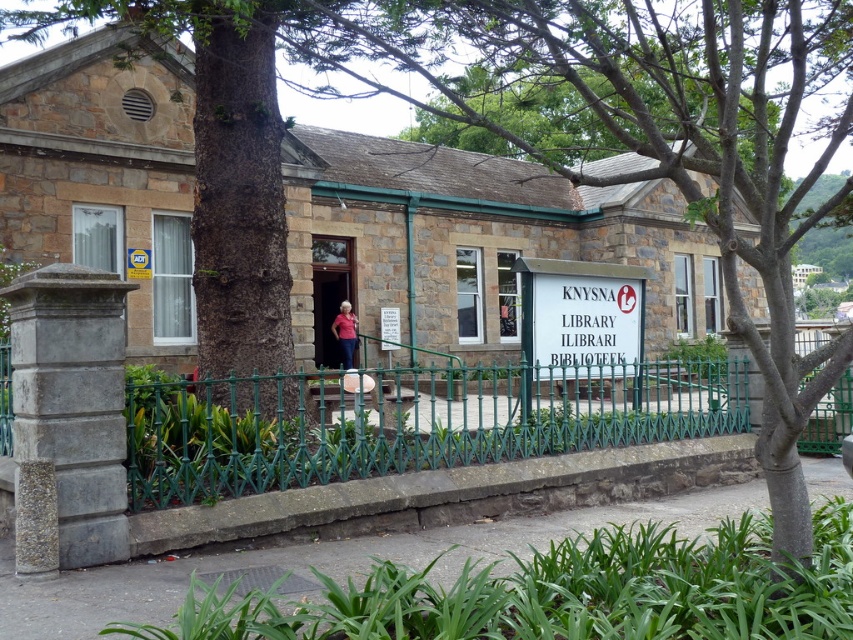
Can you confirm if green leafy tree at center is smaller than white plastic sign at center?

No, green leafy tree at center is not smaller than white plastic sign at center.

Is green leafy tree at center above white plastic sign at center?

Yes, green leafy tree at center is above white plastic sign at center.

Identify the location of green leafy tree at center. This screenshot has height=640, width=853. (669, 144).

Can you confirm if green leafy tree at center is bigger than green wrought iron fence at center?

Indeed, green leafy tree at center has a larger size compared to green wrought iron fence at center.

Locate an element on the screen. green leafy tree at center is located at coordinates (669, 144).

The image size is (853, 640). I want to click on green leafy tree at center, so click(x=669, y=144).

Is green leafy tree at center closer to the viewer compared to pink fabric shirt at center?

Yes, green leafy tree at center is closer to the viewer.

Describe the element at coordinates (669, 144) in the screenshot. The image size is (853, 640). I see `green leafy tree at center` at that location.

Find the location of a particular element. The image size is (853, 640). green leafy tree at center is located at coordinates (669, 144).